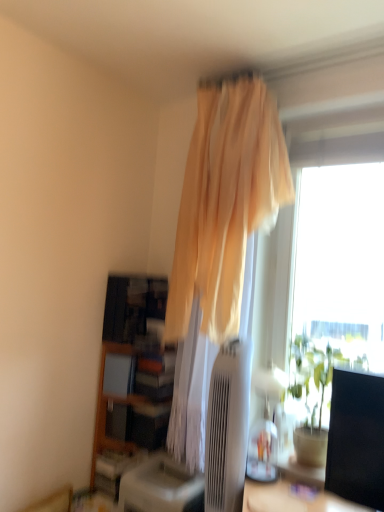
I want to click on beige sheer curtain at upper center, so click(x=225, y=204).

The height and width of the screenshot is (512, 384). Describe the element at coordinates (225, 204) in the screenshot. I see `beige sheer curtain at upper center` at that location.

Describe the element at coordinates (228, 426) in the screenshot. I see `satin beige air conditioner at center` at that location.

Identify the location of green leafy plant at right. The width and height of the screenshot is (384, 512). (315, 405).

Which is behind, point (136, 417) or point (296, 426)?

The point (136, 417) is farther.

Considering the relative sizes of wooden bookshelf at lower left and green leafy plant at right in the image provided, is wooden bookshelf at lower left bigger than green leafy plant at right?

Correct, wooden bookshelf at lower left is larger in size than green leafy plant at right.

Is wooden bookshelf at lower left positioned far away from green leafy plant at right?

They are positioned close to each other.

From the image's perspective, which is below, wooden bookshelf at lower left or green leafy plant at right?

wooden bookshelf at lower left.

Considering the relative sizes of wooden bookshelf at lower left and beige sheer curtain at upper center in the image provided, is wooden bookshelf at lower left bigger than beige sheer curtain at upper center?

No, wooden bookshelf at lower left is not bigger than beige sheer curtain at upper center.

Considering the points (126, 458) and (174, 290), which point is in front, point (126, 458) or point (174, 290)?

Positioned in front is point (174, 290).

Looking at this image, from a real-world perspective, is wooden bookshelf at lower left on top of beige sheer curtain at upper center?

No, from a real-world perspective, wooden bookshelf at lower left is not over beige sheer curtain at upper center

Is wooden bookshelf at lower left facing away from beige sheer curtain at upper center?

No, wooden bookshelf at lower left's orientation is not away from beige sheer curtain at upper center.

Considering the sizes of objects beige sheer curtain at upper center and green leafy plant at right in the image provided, who is bigger, beige sheer curtain at upper center or green leafy plant at right?

With larger size is beige sheer curtain at upper center.

Could you tell me if beige sheer curtain at upper center is facing green leafy plant at right?

No, beige sheer curtain at upper center is not facing towards green leafy plant at right.

Where is `houseplant to the right of beige sheer curtain at upper center`? houseplant to the right of beige sheer curtain at upper center is located at coordinates (315, 405).

Can you confirm if beige sheer curtain at upper center is thinner than green leafy plant at right?

No.

From the image's perspective, which object appears higher, satin beige air conditioner at center or green leafy plant at right?

green leafy plant at right appears higher in the image.

You are a GUI agent. You are given a task and a screenshot of the screen. Output one action in this format:
    pyautogui.click(x=<x>, y=<y>)
    Task: Click on the air conditioner to the left of green leafy plant at right
    The image size is (384, 512).
    Given the screenshot: What is the action you would take?
    pyautogui.click(x=228, y=426)

Would you say green leafy plant at right is part of satin beige air conditioner at center's contents?

Actually, green leafy plant at right is outside satin beige air conditioner at center.

From a real-world perspective, which object rests below the other?

satin beige air conditioner at center, from a real-world perspective.

Can you confirm if green leafy plant at right is thinner than beige sheer curtain at upper center?

Yes.

Considering the relative positions of green leafy plant at right and beige sheer curtain at upper center in the image provided, is green leafy plant at right to the left or to the right of beige sheer curtain at upper center?

From the image, it's evident that green leafy plant at right is to the right of beige sheer curtain at upper center.

Who is shorter, green leafy plant at right or wooden bookshelf at lower left?

green leafy plant at right is shorter.

Is point (293, 437) farther from camera compared to point (107, 337)?

No, (293, 437) is in front of (107, 337).

Based on the photo, how many degrees apart are the facing directions of green leafy plant at right and wooden bookshelf at lower left?

The angular difference between green leafy plant at right and wooden bookshelf at lower left is 5.84 degrees.

Is satin beige air conditioner at center beside beige sheer curtain at upper center?

satin beige air conditioner at center is not next to beige sheer curtain at upper center, and they're not touching.

Which is less distant, (225,434) or (236,128)?

The point (225,434) is closer.

Who is taller, satin beige air conditioner at center or beige sheer curtain at upper center?

beige sheer curtain at upper center is taller.

Considering the positions of objects satin beige air conditioner at center and beige sheer curtain at upper center in the image provided, who is in front, satin beige air conditioner at center or beige sheer curtain at upper center?

Positioned in front is satin beige air conditioner at center.

What are the coordinates of `houseplant to the right of wooden bookshelf at lower left` in the screenshot? It's located at (315, 405).

At what (x,y) coordinates should I click in order to perform the action: click on bookshelf on the left of beige sheer curtain at upper center. Please return your answer as a coordinate pair (x, y). The height and width of the screenshot is (512, 384). Looking at the image, I should click on (130, 379).

Which object lies further to the anchor point wooden bookshelf at lower left, beige sheer curtain at upper center or green leafy plant at right?

green leafy plant at right is further to wooden bookshelf at lower left.

Consider the image. When comparing their distances from wooden bookshelf at lower left, does green leafy plant at right or beige sheer curtain at upper center seem further?

green leafy plant at right.

Considering their positions, is green leafy plant at right positioned further to wooden bookshelf at lower left than satin beige air conditioner at center?

The object further to wooden bookshelf at lower left is green leafy plant at right.

Considering their positions, is satin beige air conditioner at center positioned further to beige sheer curtain at upper center than wooden bookshelf at lower left?

The object further to beige sheer curtain at upper center is wooden bookshelf at lower left.

Estimate the real-world distances between objects in this image. Which object is further from satin beige air conditioner at center, green leafy plant at right or beige sheer curtain at upper center?

Among the two, beige sheer curtain at upper center is located further to satin beige air conditioner at center.

From the image, which object appears to be nearer to satin beige air conditioner at center, wooden bookshelf at lower left or green leafy plant at right?

green leafy plant at right lies closer to satin beige air conditioner at center than the other object.

Based on their spatial positions, is green leafy plant at right or wooden bookshelf at lower left closer to satin beige air conditioner at center?

green leafy plant at right is closer to satin beige air conditioner at center.

Considering their positions, is satin beige air conditioner at center positioned further to green leafy plant at right than beige sheer curtain at upper center?

Based on the image, beige sheer curtain at upper center appears to be further to green leafy plant at right.

The image size is (384, 512). I want to click on houseplant between beige sheer curtain at upper center and wooden bookshelf at lower left in the vertical direction, so click(315, 405).

You are a GUI agent. You are given a task and a screenshot of the screen. Output one action in this format:
    pyautogui.click(x=<x>, y=<y>)
    Task: Click on the houseplant between beige sheer curtain at upper center and satin beige air conditioner at center in the vertical direction
    This screenshot has width=384, height=512.
    Given the screenshot: What is the action you would take?
    pyautogui.click(x=315, y=405)

You are a GUI agent. You are given a task and a screenshot of the screen. Output one action in this format:
    pyautogui.click(x=<x>, y=<y>)
    Task: Click on the air conditioner between beige sheer curtain at upper center and wooden bookshelf at lower left from top to bottom
    
    Given the screenshot: What is the action you would take?
    pos(228,426)

This screenshot has height=512, width=384. In order to click on air conditioner located between wooden bookshelf at lower left and green leafy plant at right in the left-right direction in this screenshot , I will do `click(228, 426)`.